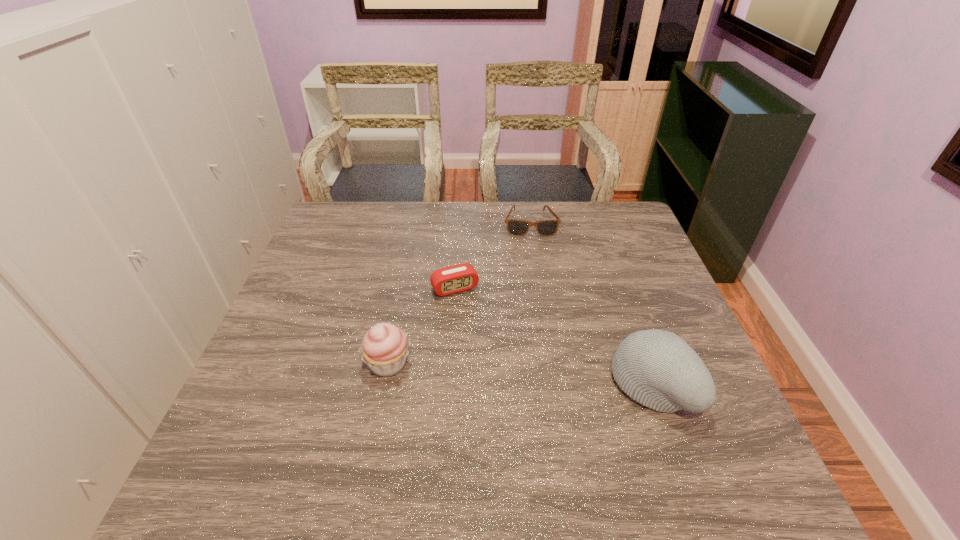
Identify the location of cupcake. (384, 349).

Find the location of a particular element. The height and width of the screenshot is (540, 960). beanie is located at coordinates (658, 369).

At what (x,y) coordinates should I click in order to perform the action: click on the farthest object. Please return your answer as a coordinate pair (x, y). This screenshot has width=960, height=540. Looking at the image, I should click on [x=515, y=227].

Locate an element on the screen. sunglasses is located at coordinates (515, 227).

Locate an element on the screen. The height and width of the screenshot is (540, 960). alarm clock is located at coordinates (457, 278).

The image size is (960, 540). I want to click on the second farthest object, so click(x=457, y=278).

This screenshot has height=540, width=960. Identify the location of vacant area situated on the front of the cupcake. (380, 408).

The width and height of the screenshot is (960, 540). I want to click on free region located 0.120m on the left of the rightmost object, so click(x=559, y=384).

Image resolution: width=960 pixels, height=540 pixels. In order to click on vacant space located on the frames of the third object from left to right in this screenshot , I will do `click(539, 293)`.

You are a GUI agent. You are given a task and a screenshot of the screen. Output one action in this format:
    pyautogui.click(x=<x>, y=<y>)
    Task: Click on the vacant space positioned on the frames of the third object from left to right
    The width and height of the screenshot is (960, 540).
    Given the screenshot: What is the action you would take?
    pyautogui.click(x=539, y=288)